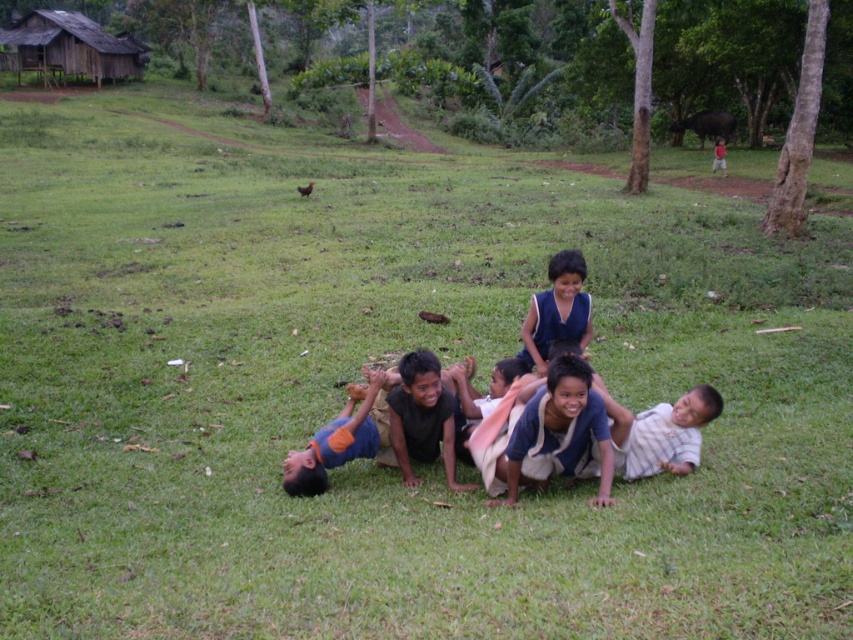
You are a photographer trying to capture a photo of the blue fabric shirt at center without the brown wooden hut at upper left appearing in the background. Is this possible given their relative heights?

The brown wooden hut at upper left is taller than the blue fabric shirt at center, so the photographer can position themselves lower to frame the shot so the hut is out of the background while still capturing the blue fabric shirt at center.